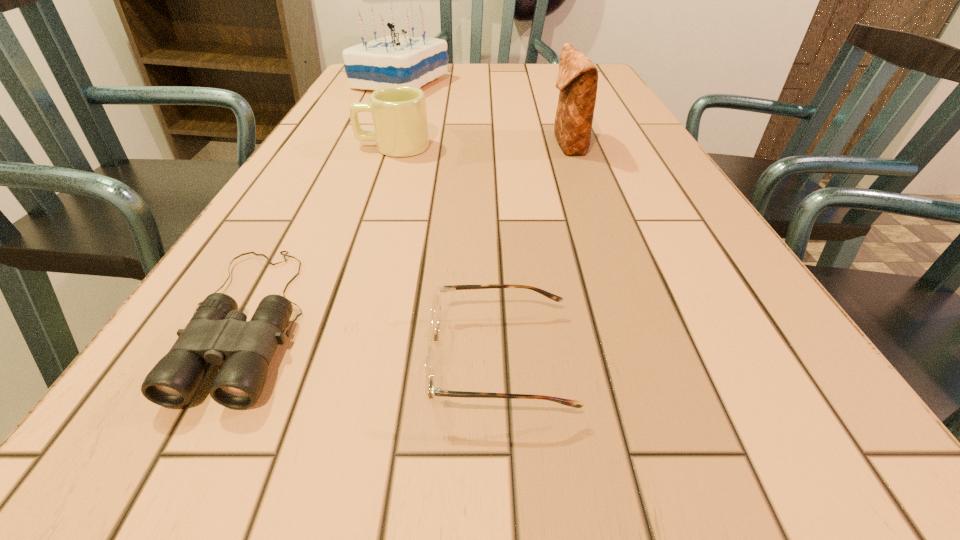
Locate an element on the screen. This screenshot has width=960, height=540. object at the far left corner is located at coordinates (394, 60).

Where is `free region at the far edge of the desktop`? The height and width of the screenshot is (540, 960). free region at the far edge of the desktop is located at coordinates (477, 70).

I want to click on free space at the near edge of the desktop, so click(x=653, y=526).

Locate an element on the screen. vacant space at the left edge is located at coordinates (365, 100).

In order to click on blank space at the right edge of the desktop in this screenshot , I will do `click(631, 107)`.

The height and width of the screenshot is (540, 960). What are the coordinates of `free space at the near left corner` in the screenshot? It's located at (189, 529).

In the image, there is a desktop. Where is `free space at the near right corner`? The height and width of the screenshot is (540, 960). free space at the near right corner is located at coordinates (758, 501).

I want to click on empty location between the clutch bag and the third tallest object, so click(x=480, y=146).

Locate an element on the screen. free spot between the birthday cake and the binoculars is located at coordinates (325, 201).

Locate an element on the screen. unoccupied area between the farthest object and the clutch bag is located at coordinates (484, 114).